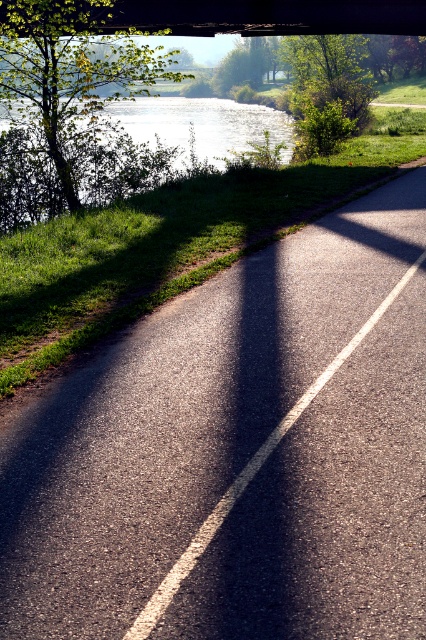
Consider the image. You are standing on the road under the bridge and want to walk to both the point at coordinates (83, 544) and the point at coordinates (135, 147). Which point will you reach first if you start walking straight ahead?

You will reach the point at coordinates (83, 544) first because it is closer to you than the point at coordinates (135, 147).

You are standing at the camera position and want to walk to the asphalt at center. How many steps would you need to take if each step covers 0.75 meters?

The distance between the camera and the asphalt at center is 3.75 meters. Since each step covers 0.75 meters, you would need to take 5 steps to reach the asphalt at center.